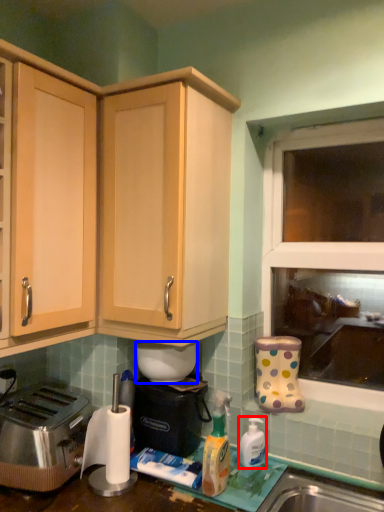
Question: Which point is closer to the camera, bottle (highlighted by a red box) or appliance (highlighted by a blue box)?

Choices:
 (A) bottle
 (B) appliance

Answer: (A)